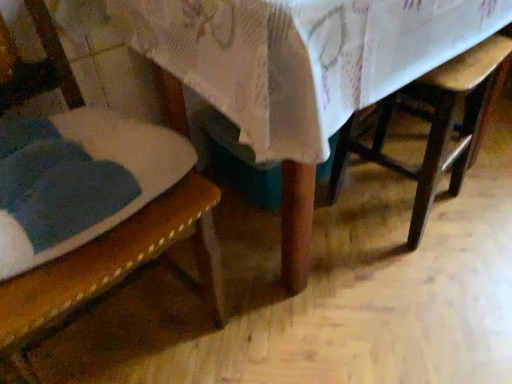
Question: From the image's perspective, is wooden table at center located above or below wooden textured chair at left?

Choices:
 (A) below
 (B) above

Answer: (B)

Question: Looking at the image, does wooden table at center seem bigger or smaller compared to wooden textured chair at left?

Choices:
 (A) small
 (B) big

Answer: (B)

Question: Which object is positioned closest to the wooden textured chair at left?

Choices:
 (A) wooden table at center
 (B) wooden chair at lower right

Answer: (A)

Question: Based on their relative distances, which object is nearer to the wooden table at center?

Choices:
 (A) wooden chair at lower right
 (B) wooden textured chair at left

Answer: (B)